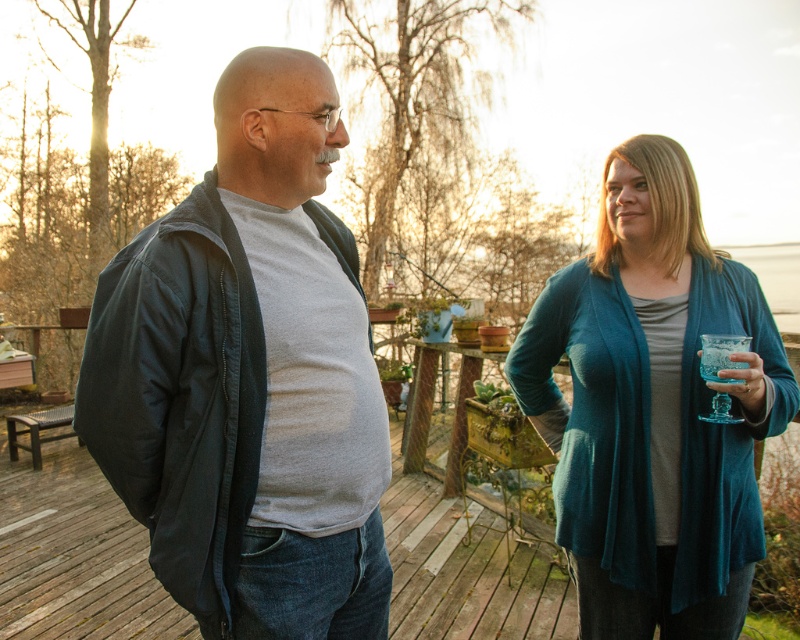
In the scene shown: You are a photographer positioned at the center of the scene. You need to focus your camera on the matte black jacket at left. What are the coordinates where you should aim your camera?

The coordinates to focus on the matte black jacket at left are at point (228, 374).

You are a photographer setting up a camera to take a portrait of the two people. The matte black jacket at left and the teal knit cardigan at right are important elements. Based on their sizes, which of these two items would you need to position closer to the camera to ensure they appear equally sized in the photo?

The matte black jacket at left has a lesser width compared to the teal knit cardigan at right. To make them appear equally sized in the photo, you should position the matte black jacket at left closer to the camera since it is smaller in width.